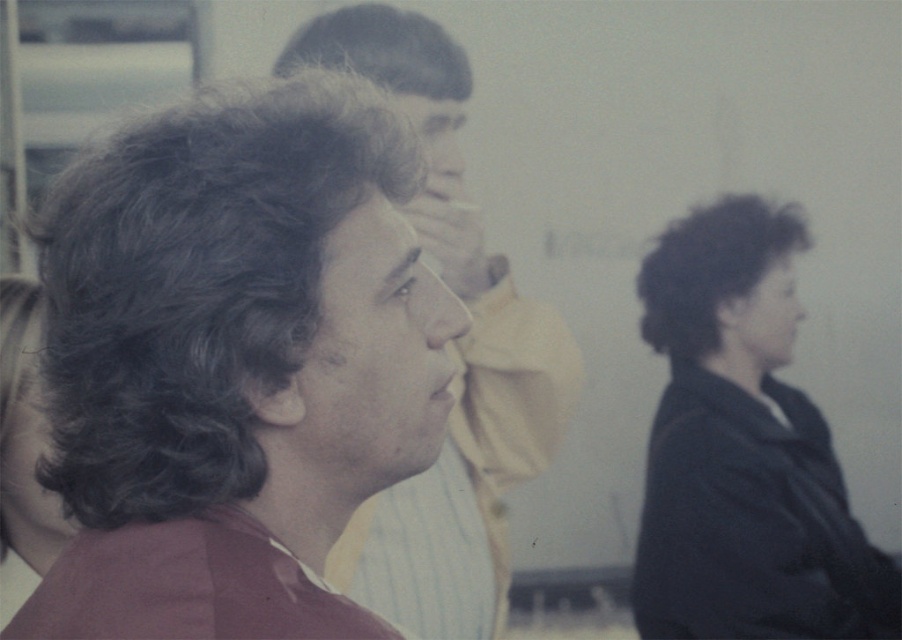
Who is more forward, (689, 618) or (530, 380)?

Point (530, 380)

Can you confirm if black matte jacket at lower right is shorter than matte brown hair at center?

Indeed, black matte jacket at lower right has a lesser height compared to matte brown hair at center.

Is point (836, 589) farther from camera compared to point (502, 289)?

Yes, it is behind point (502, 289).

The image size is (902, 640). What are the coordinates of `black matte jacket at lower right` in the screenshot? It's located at (743, 451).

Does dark brown hair at left come in front of matte brown hair at center?

That is True.

Does point (296, 384) lie in front of point (557, 340)?

Yes, it is.

Locate an element on the screen. The width and height of the screenshot is (902, 640). dark brown hair at left is located at coordinates (235, 364).

Which is below, dark brown hair at left or black matte jacket at lower right?

black matte jacket at lower right is lower down.

Is the position of dark brown hair at left more distant than that of black matte jacket at lower right?

No, it is in front of black matte jacket at lower right.

This screenshot has height=640, width=902. Find the location of `dark brown hair at left`. dark brown hair at left is located at coordinates (x=235, y=364).